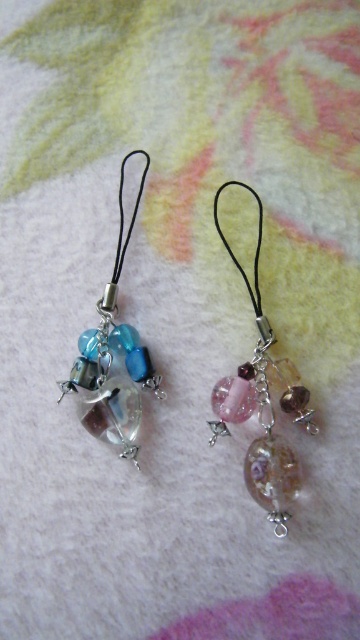
You are looking at the two points in the image, point (267, 332) and point (114, 326). Which point is closer to you?

Point (267, 332) is closer to the camera than point (114, 326).

In the scene shown: You are an artisan who wants to place both charms on a display stand. The display stand has a slot that can only accommodate charms with a width of 3 cm or less. You have the translucent pink glass charm at center and the translucent glass charm at left. Which charm should you choose to fit into the slot?

The translucent pink glass charm at center has a width less than the translucent glass charm at left, so the translucent pink glass charm at center will fit into the 3 cm slot if the left charm is over 3 cm. However, without knowing the exact width of the left charm, we can only confirm the pink one is narrower. If the left charm exceeds 3 cm, the pink one might fit. But since the problem states the slot is 3 cm or less, and the pink is smaller, it is safer to choose the translucent pink glass charm at the

You are a photographer holding a camera 4.30 feet away from the translucent pink glass charm at center. The charm is on a towel. Can you capture the entire charm in your photo without moving the camera?

The distance between the camera and the translucent pink glass charm at center is exactly 4.30 feet. Whether the entire charm can be captured depends on the camera lens and field of view. Since the charm is small and the distance is fixed, you might need a wide angle lens to ensure the entire charm fits in the frame.